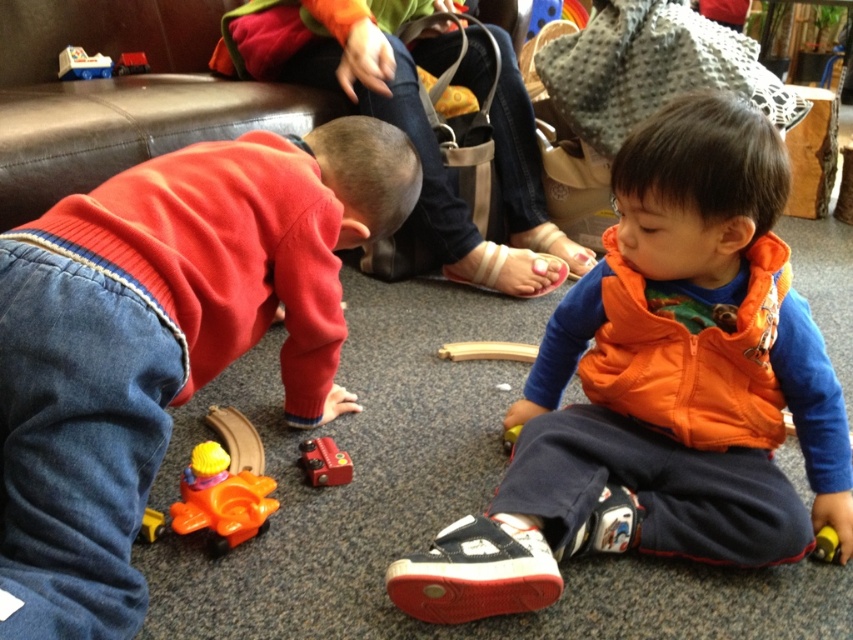
You are a parent looking at the image of your children playing. You notice a point at coordinates (415,124). What object is located at this point?

The object at point (415,124) is the matte orange sweater at lower left.

You are a parent looking at the image of your children playing. You notice a matte orange vest at lower right and a bright orange toy train with a yellow figure on top. Which object is closer to the point at coordinates (x=164, y=339)?

The matte orange vest at lower right is located at point (x=164, y=339), so it is exactly at that coordinate and therefore closer than the bright orange toy train with a yellow figure on top.

You are a parent looking at the children playing on the carpet. You see the matte orange vest at lower right and the yellow plastic toy at lower right. Which one is closer to the right edge of the carpet?

The yellow plastic toy at lower right is closer to the right edge of the carpet because the matte orange vest at lower right is positioned on the left side of it.